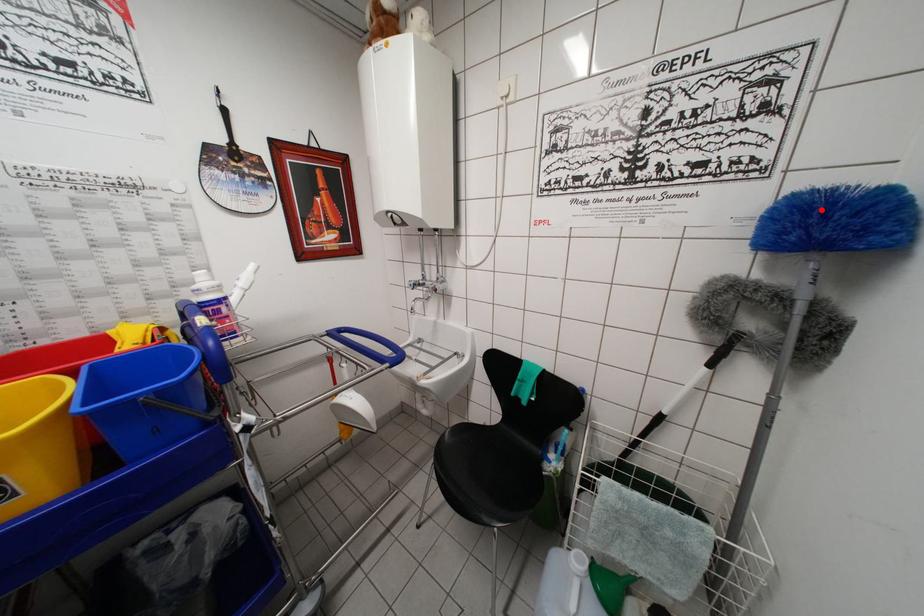
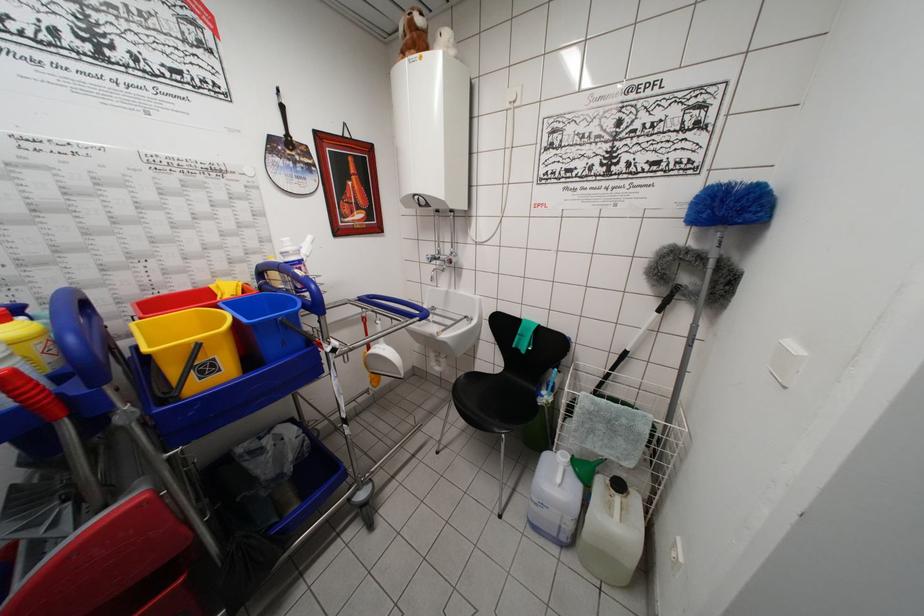
Where in the second image is the point corresponding to the highlighted location from the first image?

(723, 199)